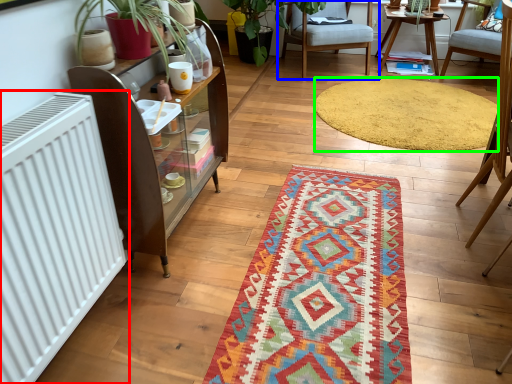
Question: Considering the real-world distances, which object is closest to radiator (highlighted by a red box)? chair (highlighted by a blue box) or mat (highlighted by a green box).

Choices:
 (A) chair
 (B) mat

Answer: (B)